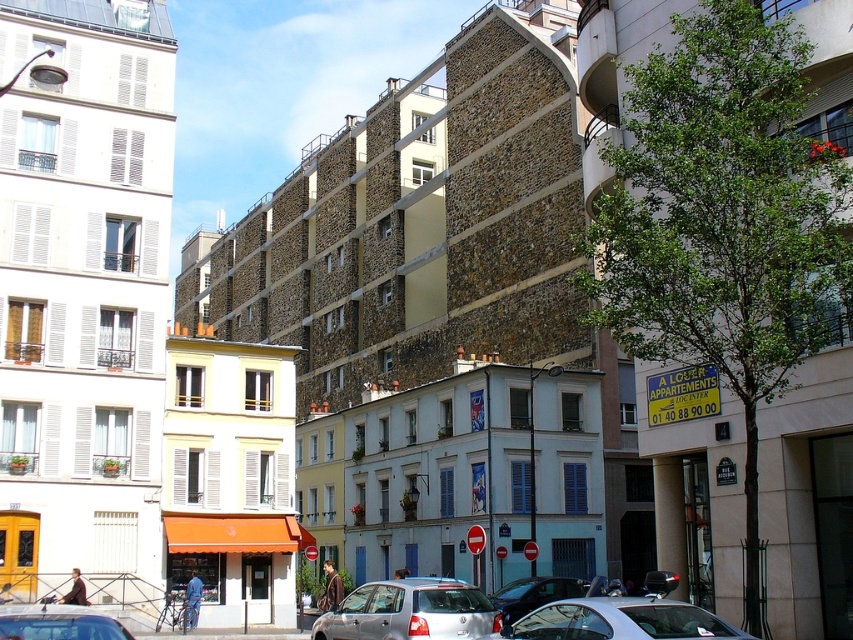
Which is more to the right, metallic silver car at lower center or silver metallic car at lower left?

metallic silver car at lower center

Does metallic silver car at lower center have a lesser width compared to silver metallic car at lower left?

Yes, metallic silver car at lower center is thinner than silver metallic car at lower left.

The height and width of the screenshot is (640, 853). Find the location of `metallic silver car at lower center`. metallic silver car at lower center is located at coordinates (618, 620).

From the picture: Is silver metallic car at center positioned behind metallic silver car at lower center?

Yes, silver metallic car at center is further from the viewer.

Can you confirm if silver metallic car at center is thinner than metallic silver car at lower center?

Incorrect, silver metallic car at center's width is not less than metallic silver car at lower center's.

Locate an element on the screen. Image resolution: width=853 pixels, height=640 pixels. silver metallic car at center is located at coordinates (409, 611).

Does silver metallic car at center lie in front of silver metallic car at lower left?

No, it is not.

Identify the location of silver metallic car at center. (409, 611).

Where is `silver metallic car at center`? silver metallic car at center is located at coordinates (409, 611).